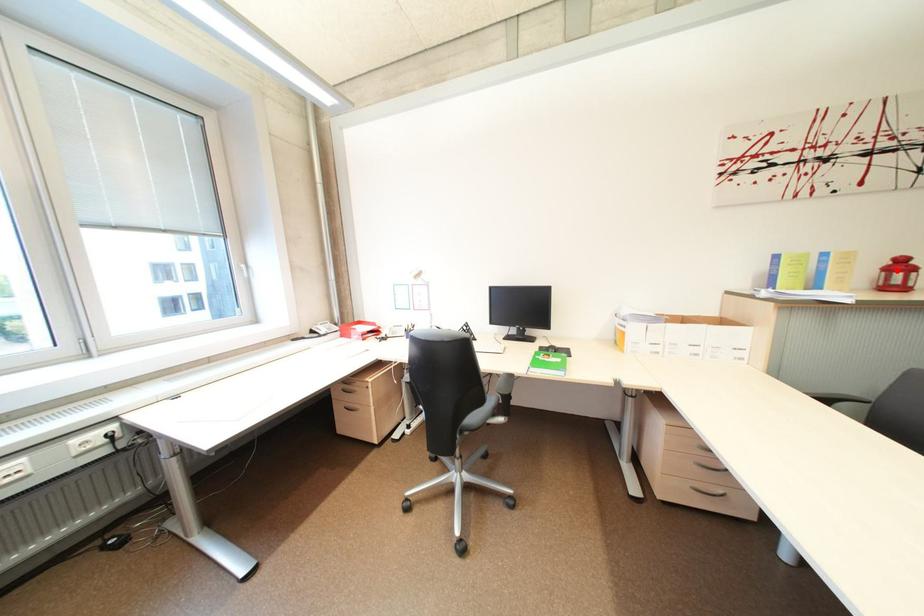
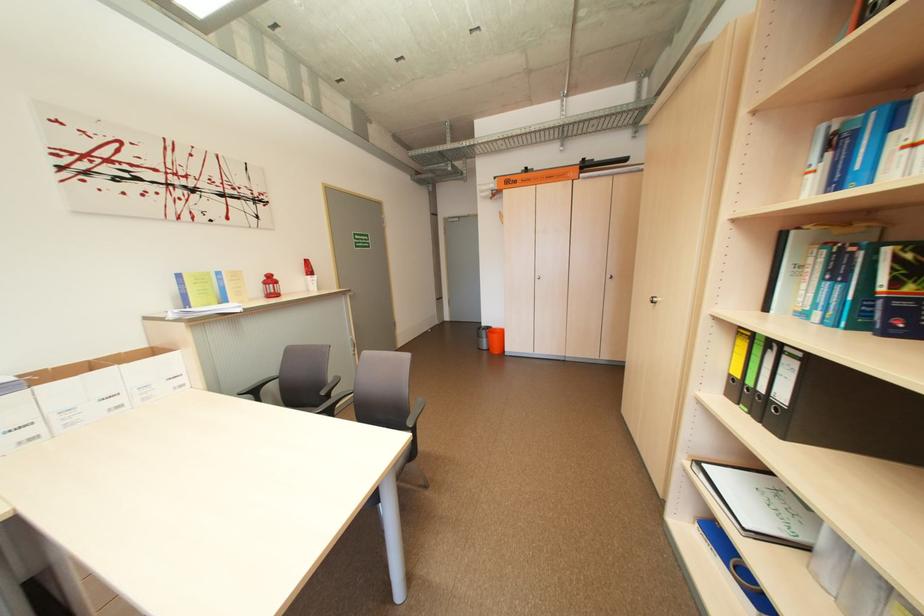
In the second image, find the point that corresponds to the highlighted location in the first image.

(274, 284)